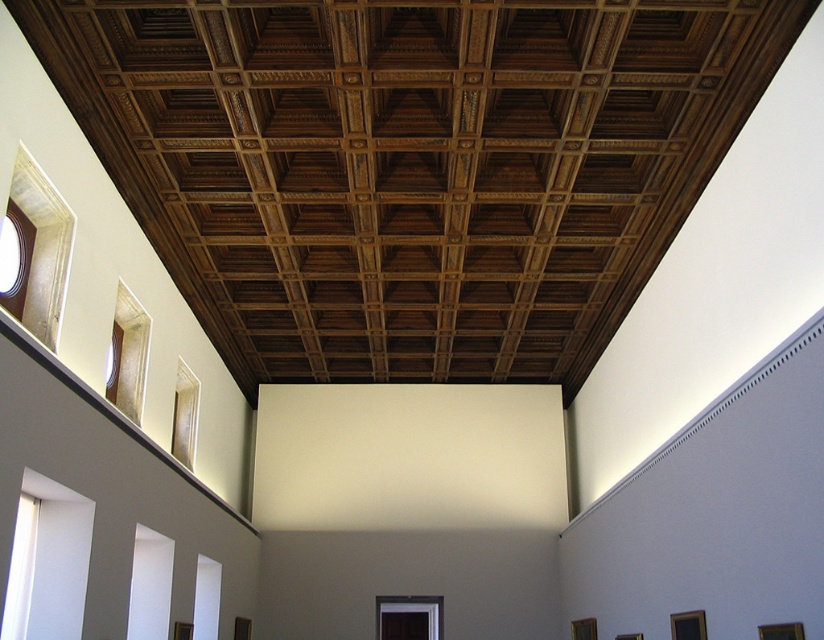
Is clear glass window at upper center closer to camera compared to transparent glass window at lower right?

No.

Between point (186, 408) and point (705, 628), which one is positioned in front?

Point (705, 628) is in front.

Between point (186, 400) and point (680, 634), which one is positioned in front?

Point (680, 634) is in front.

This screenshot has height=640, width=824. Identify the location of clear glass window at upper center. (185, 416).

Is white glossy window at lower left to the right of transparent glass window at lower center from the viewer's perspective?

In fact, white glossy window at lower left is to the left of transparent glass window at lower center.

Image resolution: width=824 pixels, height=640 pixels. Describe the element at coordinates (148, 586) in the screenshot. I see `white glossy window at lower left` at that location.

Image resolution: width=824 pixels, height=640 pixels. In order to click on white glossy window at lower left in this screenshot , I will do `click(148, 586)`.

Based on the photo, does matte white frame at upper left appear over matte glass window at center?

Indeed, matte white frame at upper left is positioned over matte glass window at center.

Does point (52, 324) lie in front of point (439, 604)?

Yes.

You are a GUI agent. You are given a task and a screenshot of the screen. Output one action in this format:
    pyautogui.click(x=<x>, y=<y>)
    Task: Click on the matte white frame at upper left
    
    Given the screenshot: What is the action you would take?
    pyautogui.click(x=43, y=248)